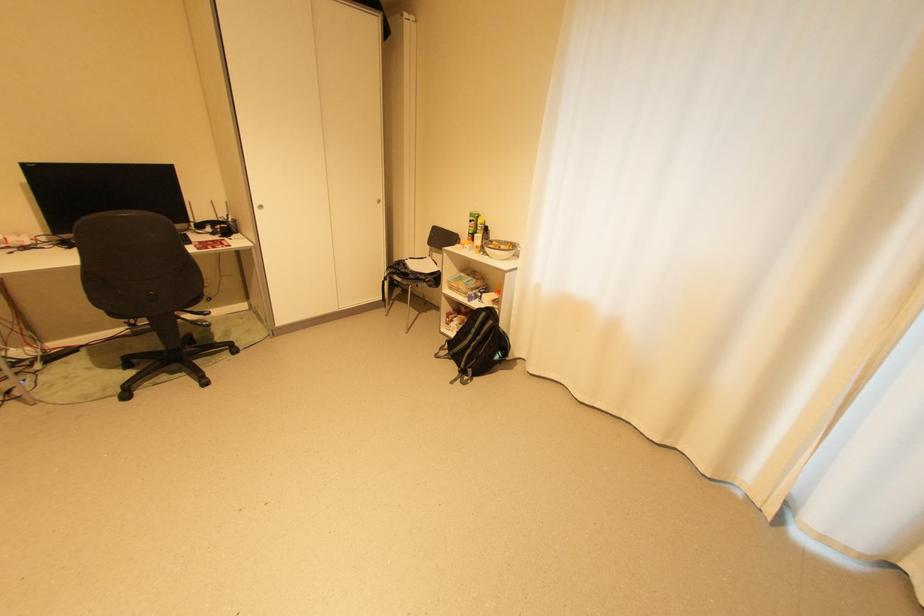
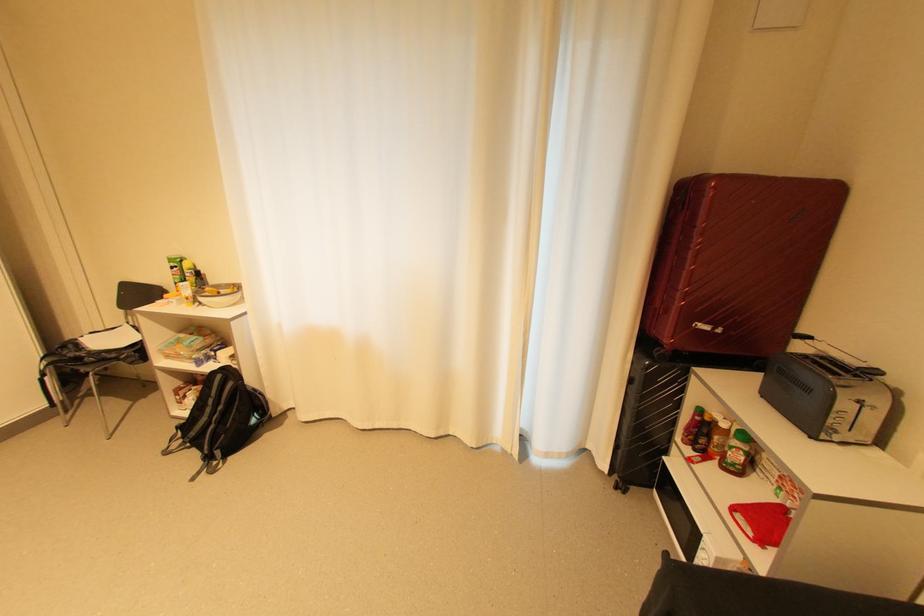
Where in the second image is the point corresponding to pixel 480 219 from the first image?

(180, 265)